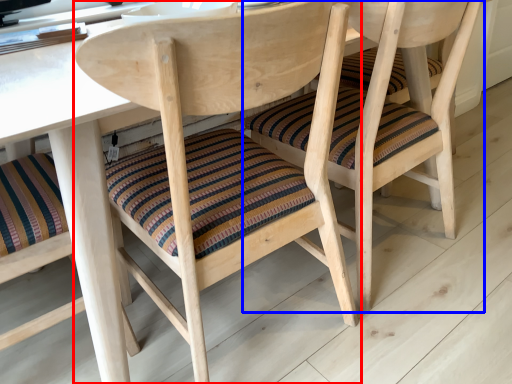
Question: Which object is further to the camera taking this photo, chair (highlighted by a red box) or chair (highlighted by a blue box)?

Choices:
 (A) chair
 (B) chair

Answer: (B)